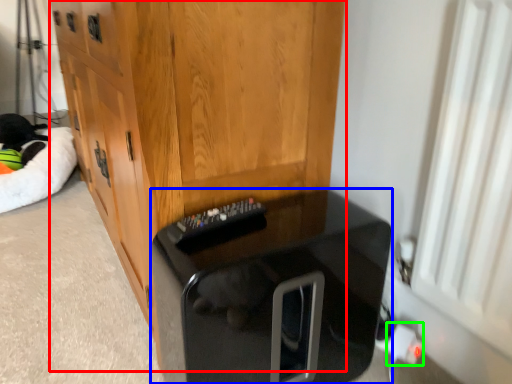
Question: Estimate the real-world distances between objects in this image. Which object is farther from cabinetry (highlighted by a red box), furniture (highlighted by a blue box) or electric outlet (highlighted by a green box)?

Choices:
 (A) furniture
 (B) electric outlet

Answer: (B)